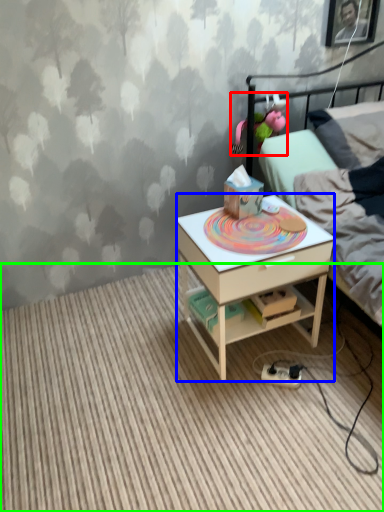
Question: Which object is the closest to the toy (highlighted by a red box)? Choose among these: desk (highlighted by a blue box) or plain (highlighted by a green box).

Choices:
 (A) desk
 (B) plain

Answer: (A)